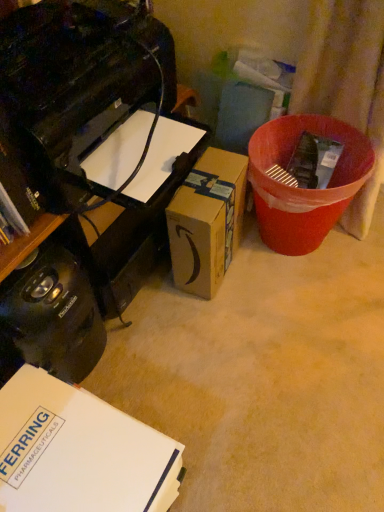
Question: Considering the relative positions of black glossy printer at upper left and white cardboard box at lower left, the 1th box positioned from the bottom, in the image provided, is black glossy printer at upper left to the left or to the right of white cardboard box at lower left, the 1th box positioned from the bottom,?

Choices:
 (A) left
 (B) right

Answer: (B)

Question: From the image's perspective, is black glossy printer at upper left above or below white cardboard box at lower left, the 1th box positioned from the bottom?

Choices:
 (A) below
 (B) above

Answer: (B)

Question: Which object is positioned farthest from the brown cardboard box at center, placed as the 2th box when sorted from bottom to top?

Choices:
 (A) black glossy printer at upper left
 (B) black plastic printer at left
 (C) white cardboard box at lower left, the first box when ordered from left to right
 (D) red plastic bin at right
 (E) black plastic toaster at lower left

Answer: (C)

Question: Which is farther from the black glossy printer at upper left?

Choices:
 (A) black plastic toaster at lower left
 (B) white cardboard box at lower left, the 2th box viewed from the top
 (C) red plastic bin at right
 (D) brown cardboard box at center, which is the 2th box in front-to-back order
 (E) black plastic printer at left

Answer: (B)